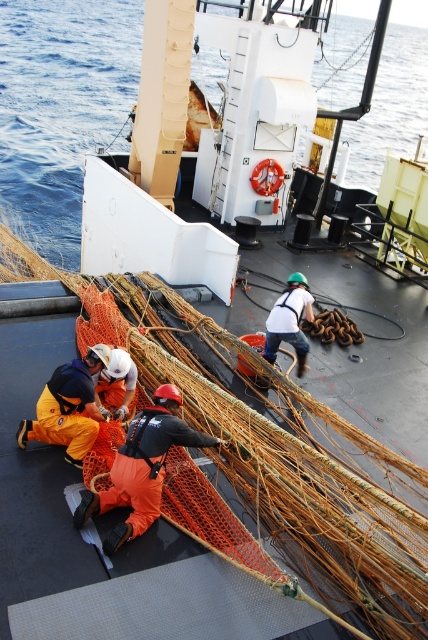
Question: In this image, where is orange fabric at center located relative to white fabric safety harness at center?

Choices:
 (A) left
 (B) right

Answer: (A)

Question: Can you confirm if orange fabric at center is wider than orange fabric worker at lower left?

Choices:
 (A) no
 (B) yes

Answer: (B)

Question: Which object is the closest to the orange fabric worker at lower left?

Choices:
 (A) orange fabric at lower left
 (B) white fabric safety harness at center

Answer: (A)

Question: Which point is closer to the camera?

Choices:
 (A) (95, 422)
 (B) (8, 51)
 (C) (137, 528)

Answer: (C)

Question: Among these objects, which one is farthest from the camera?

Choices:
 (A) orange fabric at lower left
 (B) white fabric safety harness at center
 (C) orange fabric worker at lower left

Answer: (B)

Question: Can you confirm if blue water at upper left is positioned below white fabric safety harness at center?

Choices:
 (A) no
 (B) yes

Answer: (A)